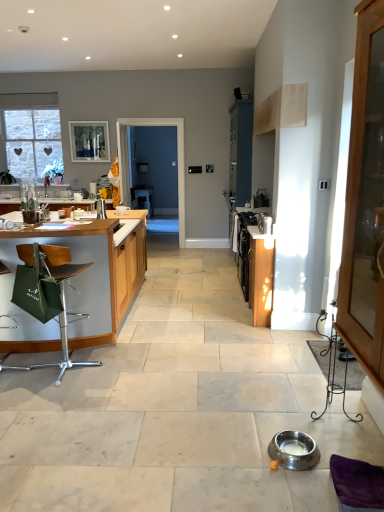
Image resolution: width=384 pixels, height=512 pixels. What are the coordinates of `free space in front of wooden cabinet at right, arranged as the first cabinetry when viewed from the back` in the screenshot? It's located at (265, 334).